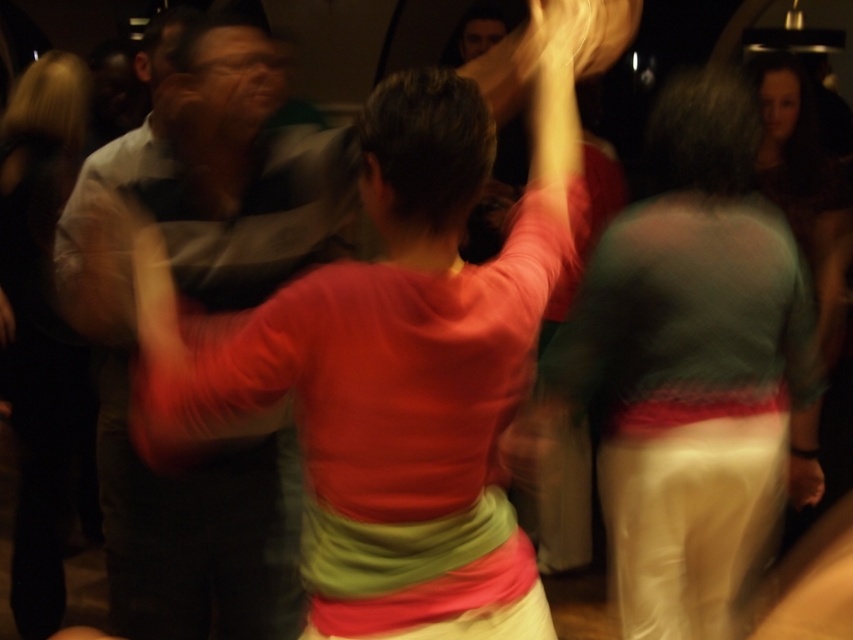
Is matte green sweater at center closer to the viewer compared to striped cotton shirt at center?

No, it is not.

Between matte green sweater at center and striped cotton shirt at center, which one appears on the left side from the viewer's perspective?

striped cotton shirt at center is more to the left.

Between point (746, 298) and point (216, 538), which one is positioned in front?

Point (216, 538) is in front.

The width and height of the screenshot is (853, 640). In order to click on matte green sweater at center in this screenshot , I will do `click(692, 365)`.

Between striped cotton shirt at center and matte red sweater at center, which one has more height?

matte red sweater at center is taller.

Can you confirm if striped cotton shirt at center is taller than matte red sweater at center?

No, striped cotton shirt at center is not taller than matte red sweater at center.

Measure the distance between point (119, 227) and camera.

Point (119, 227) and camera are 5.18 feet apart.

Where is `striped cotton shirt at center`? The width and height of the screenshot is (853, 640). striped cotton shirt at center is located at coordinates [204, 308].

Who is more distant from viewer, (633, 305) or (57, 320)?

Positioned behind is point (57, 320).

Looking at this image, does matte green sweater at center come behind matte red sweater at center?

No, it is in front of matte red sweater at center.

Describe the element at coordinates (692, 365) in the screenshot. I see `matte green sweater at center` at that location.

Locate an element on the screen. This screenshot has width=853, height=640. matte green sweater at center is located at coordinates (692, 365).